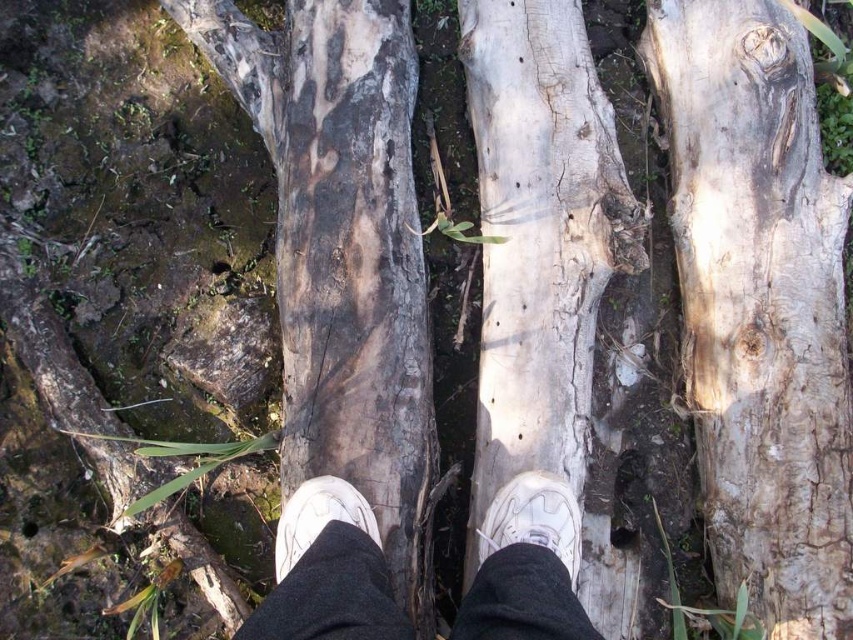
Does light brown rough bark at right have a smaller size compared to dark gray bark at center?

Yes.

The width and height of the screenshot is (853, 640). Describe the element at coordinates (759, 305) in the screenshot. I see `light brown rough bark at right` at that location.

At what (x,y) coordinates should I click in order to perform the action: click on light brown rough bark at right. Please return your answer as a coordinate pair (x, y). This screenshot has width=853, height=640. Looking at the image, I should click on (759, 305).

Who is positioned more to the left, dark gray bark at center or white cracked wood at center?

Positioned to the left is dark gray bark at center.

This screenshot has height=640, width=853. Find the location of `dark gray bark at center`. dark gray bark at center is located at coordinates coord(343,252).

You are a GUI agent. You are given a task and a screenshot of the screen. Output one action in this format:
    pyautogui.click(x=<x>, y=<y>)
    Task: Click on the dark gray bark at center
    The image size is (853, 640).
    Given the screenshot: What is the action you would take?
    point(343,252)

Which is below, dark gray bark at center or white matte sneakers at center?

white matte sneakers at center is below.

Which is above, dark gray bark at center or white matte sneakers at center?

dark gray bark at center is higher up.

Where is `dark gray bark at center`? This screenshot has width=853, height=640. dark gray bark at center is located at coordinates (343, 252).

What are the coordinates of `dark gray bark at center` in the screenshot? It's located at (343, 252).